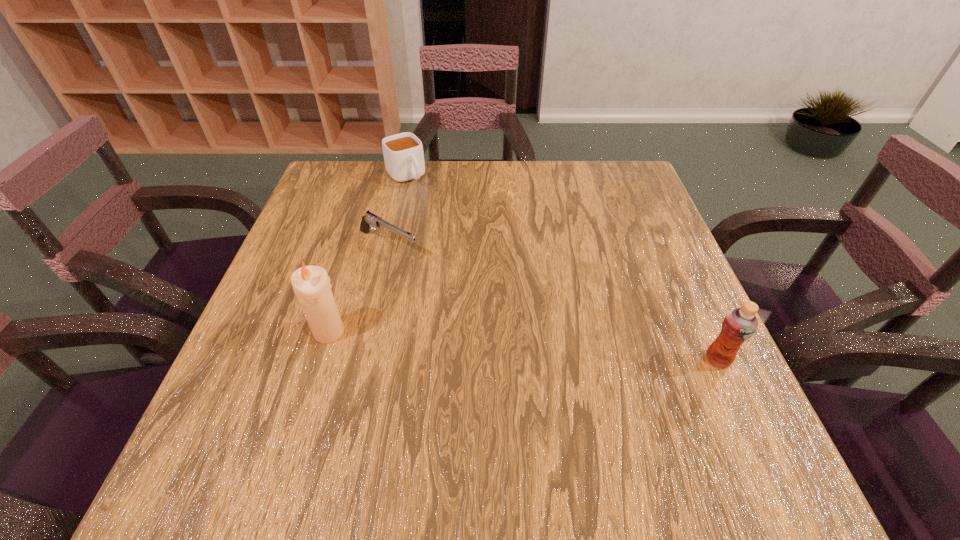
Image resolution: width=960 pixels, height=540 pixels. I want to click on vacant space located 0.070m on the front-facing side of the third nearest object, so click(435, 268).

Image resolution: width=960 pixels, height=540 pixels. I want to click on vacant area situated 0.340m on the front-facing side of the third nearest object, so click(536, 325).

You are a GUI agent. You are given a task and a screenshot of the screen. Output one action in this format:
    pyautogui.click(x=<x>, y=<y>)
    Task: Click on the vacant area situated on the front-facing side of the third nearest object
    Image resolution: width=960 pixels, height=540 pixels.
    Given the screenshot: What is the action you would take?
    pyautogui.click(x=444, y=274)

The height and width of the screenshot is (540, 960). I want to click on free region located on the side with the handle of the third tallest object, so click(489, 276).

Find the location of a particular element. vacant point located 0.180m on the side with the handle of the third tallest object is located at coordinates (444, 223).

The width and height of the screenshot is (960, 540). In order to click on vacant space located on the side with the handle of the third tallest object in this screenshot , I will do `click(434, 213)`.

You are a GUI agent. You are given a task and a screenshot of the screen. Output one action in this format:
    pyautogui.click(x=<x>, y=<y>)
    Task: Click on the object at the far edge
    This screenshot has width=960, height=540.
    Given the screenshot: What is the action you would take?
    pyautogui.click(x=403, y=153)

In order to click on candle at the left edge in this screenshot , I will do `click(311, 284)`.

Identify the location of pistol at the left edge. (369, 220).

Image resolution: width=960 pixels, height=540 pixels. In order to click on object that is positioned at the right edge in this screenshot , I will do `click(739, 324)`.